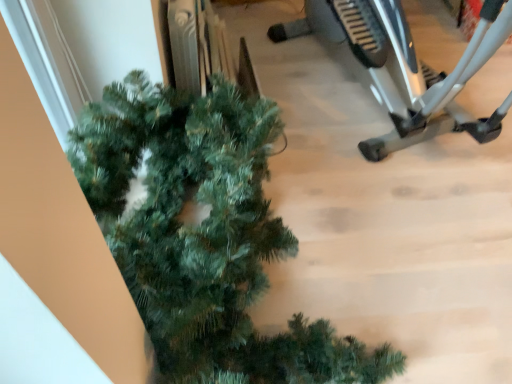
Question: Is silver metallic stationary bicycle at right situated inside green matte christmas tree at lower left or outside?

Choices:
 (A) inside
 (B) outside

Answer: (B)

Question: Looking at the image, does silver metallic stationary bicycle at right seem bigger or smaller compared to green matte christmas tree at lower left?

Choices:
 (A) big
 (B) small

Answer: (A)

Question: Relative to green matte christmas tree at lower left, is silver metallic stationary bicycle at right in front or behind?

Choices:
 (A) front
 (B) behind

Answer: (B)

Question: Considering the positions of point (285, 367) and point (415, 127), is point (285, 367) closer or farther from the camera than point (415, 127)?

Choices:
 (A) farther
 (B) closer

Answer: (B)

Question: In the image, is green matte christmas tree at lower left on the left side or the right side of silver metallic stationary bicycle at right?

Choices:
 (A) left
 (B) right

Answer: (A)

Question: From the image's perspective, is green matte christmas tree at lower left above or below silver metallic stationary bicycle at right?

Choices:
 (A) above
 (B) below

Answer: (B)

Question: From their relative heights in the image, would you say green matte christmas tree at lower left is taller or shorter than silver metallic stationary bicycle at right?

Choices:
 (A) short
 (B) tall

Answer: (A)